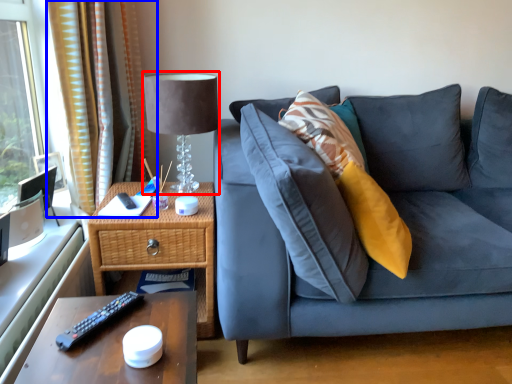
Question: Which object is further to the camera taking this photo, table lamp (highlighted by a red box) or curtain (highlighted by a blue box)?

Choices:
 (A) table lamp
 (B) curtain

Answer: (B)